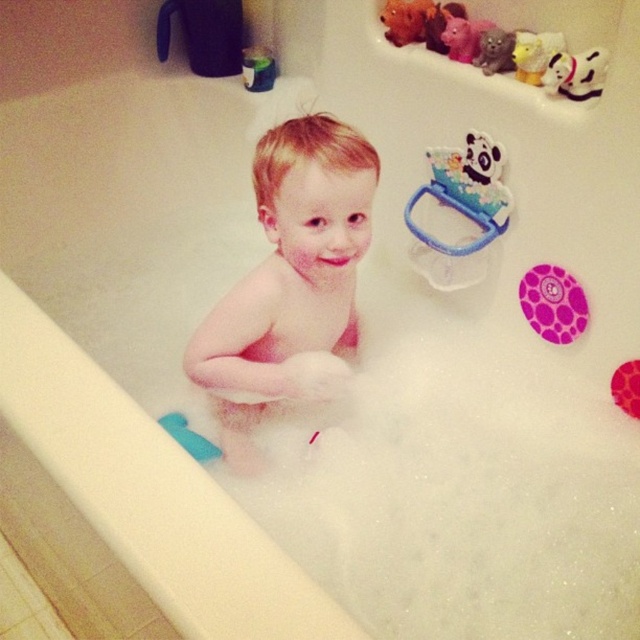
You are a parent trying to reach the white plastic panda at upper center while your child is sitting on the pink matte toddler at center. Which direction should you move to grab the panda without disturbing the child?

The pink matte toddler at center is to the left of the white plastic panda at upper center, so you should move to the right to grab the panda without disturbing the child.

You are a photographer standing at a certain distance from the bathtub. You want to take a closeup photo of the pink matte toddler at center. Considering the distance, can you get a clear closeup without moving closer?

The pink matte toddler at center is 39.00 inches away from camera. A typical camera can focus clearly at this distance, so yes, you can take a clear closeup without moving closer.

You are a parent trying to locate the purple dotted rubber ring at upper right in the bathtub scene. Based on the coordinates provided, where exactly would you find it in the image?

The purple dotted rubber ring at upper right is located at coordinates point (552,304) in the image.